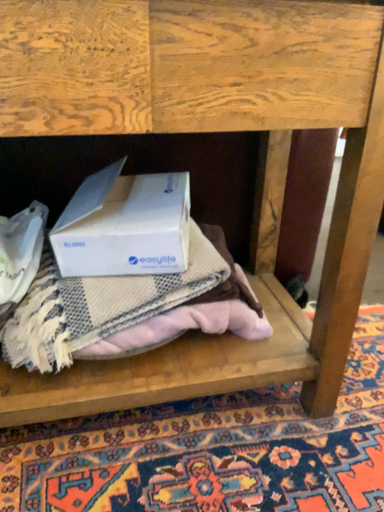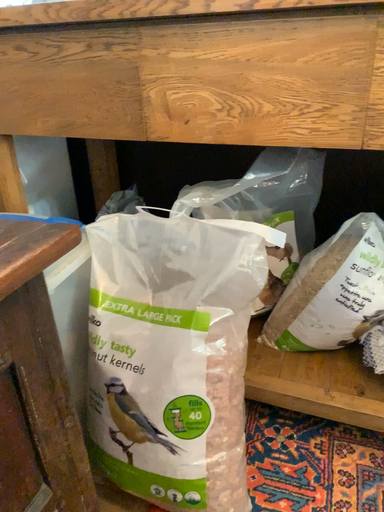
Question: Which way did the camera rotate in the video?

Choices:
 (A) rotated left
 (B) rotated right

Answer: (A)